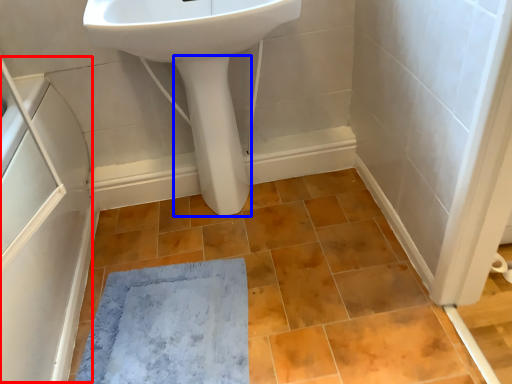
Question: Which point is further to the camera, screen door (highlighted by a red box) or bidet (highlighted by a blue box)?

Choices:
 (A) screen door
 (B) bidet

Answer: (B)